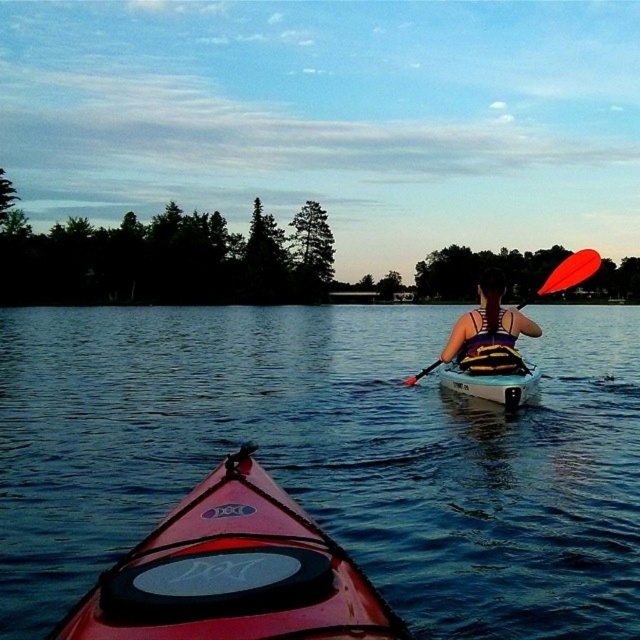
Question: Is matte yellow life vest at center bigger than white plastic canoe at center?

Choices:
 (A) no
 (B) yes

Answer: (B)

Question: Is matte yellow life vest at center further to the viewer compared to white plastic canoe at center?

Choices:
 (A) yes
 (B) no

Answer: (A)

Question: Which point is farther from the camera taking this photo?

Choices:
 (A) (600, 259)
 (B) (301, 353)
 (C) (488, 392)

Answer: (B)

Question: Which object appears closest to the camera in this image?

Choices:
 (A) orange paddle at upper right
 (B) shiny red kayak at lower center
 (C) matte yellow life vest at center
 (D) white plastic canoe at center

Answer: (B)

Question: Among these objects, which one is farthest from the camera?

Choices:
 (A) white plastic canoe at center
 (B) transparent water at center
 (C) orange paddle at upper right

Answer: (C)

Question: Does transparent water at center appear on the left side of white plastic canoe at center?

Choices:
 (A) no
 (B) yes

Answer: (B)